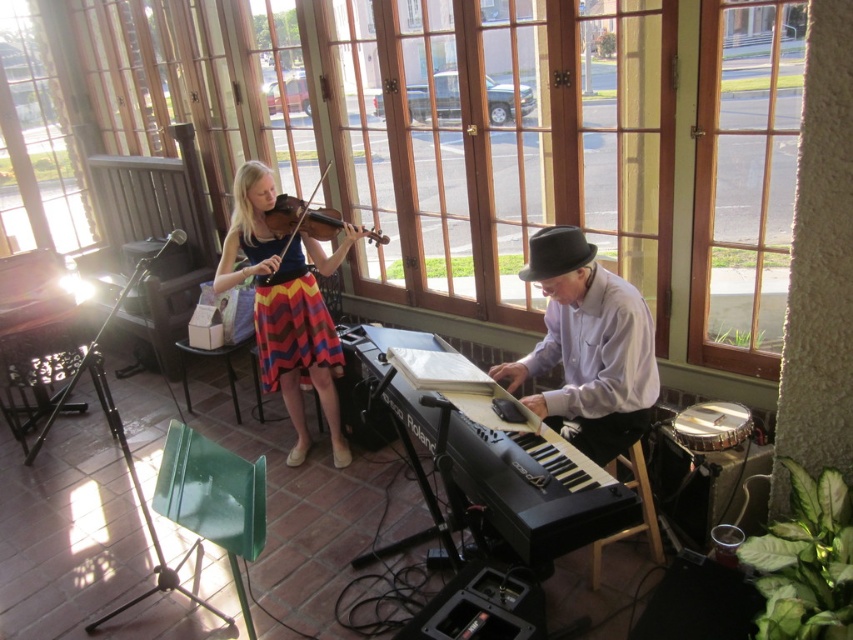
Is chevron-patterned fabric dress at center thinner than wooden violin at center?

Yes.

Consider the image. Does chevron-patterned fabric dress at center appear over wooden violin at center?

No, chevron-patterned fabric dress at center is not above wooden violin at center.

Who is more forward, (306, 305) or (338, 227)?

Point (338, 227) is more forward.

The height and width of the screenshot is (640, 853). Identify the location of chevron-patterned fabric dress at center. (292, 323).

Can you confirm if multicolored striped skirt at center is thinner than chevron-patterned fabric dress at center?

No, multicolored striped skirt at center is not thinner than chevron-patterned fabric dress at center.

Is point (271, 260) farther from camera compared to point (286, 364)?

No.

Between point (265, 378) and point (274, 243), which one is positioned in front?

Point (274, 243)

Where is `multicolored striped skirt at center`? multicolored striped skirt at center is located at coordinates (287, 307).

Does multicolored striped skirt at center have a greater height compared to wooden violin at center?

Correct, multicolored striped skirt at center is much taller as wooden violin at center.

Can you confirm if multicolored striped skirt at center is shorter than wooden violin at center?

No.

Between point (305, 332) and point (289, 224), which one is positioned behind?

Positioned behind is point (305, 332).

Identify the location of multicolored striped skirt at center. (287, 307).